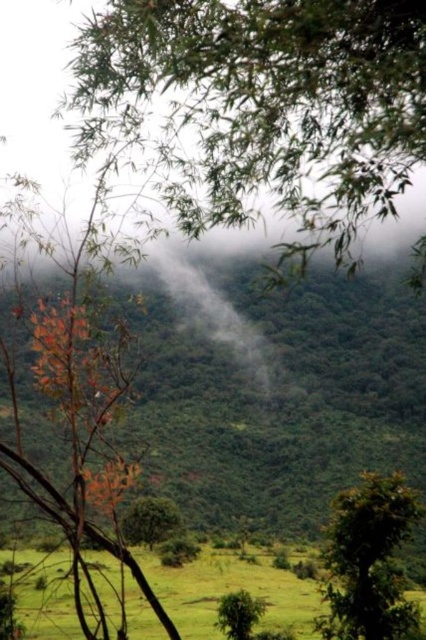
You are a hiker standing at the edge of the green grassy field at lower center. You want to reach the green matte tree at lower right. Which direction should you walk to get there?

The green grassy field at lower center is much taller than the green matte tree at lower right, so you should walk towards the lower right direction to reach the tree.